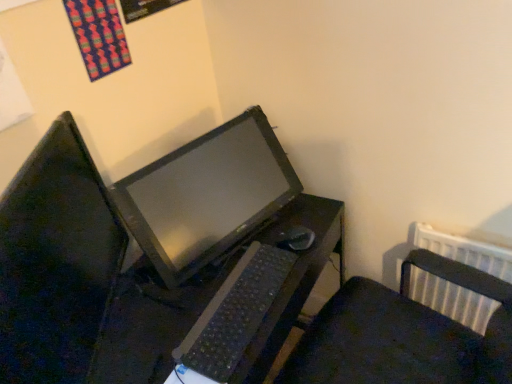
I want to click on free spot below black plastic keyboard at center (from a real-world perspective), so click(x=245, y=305).